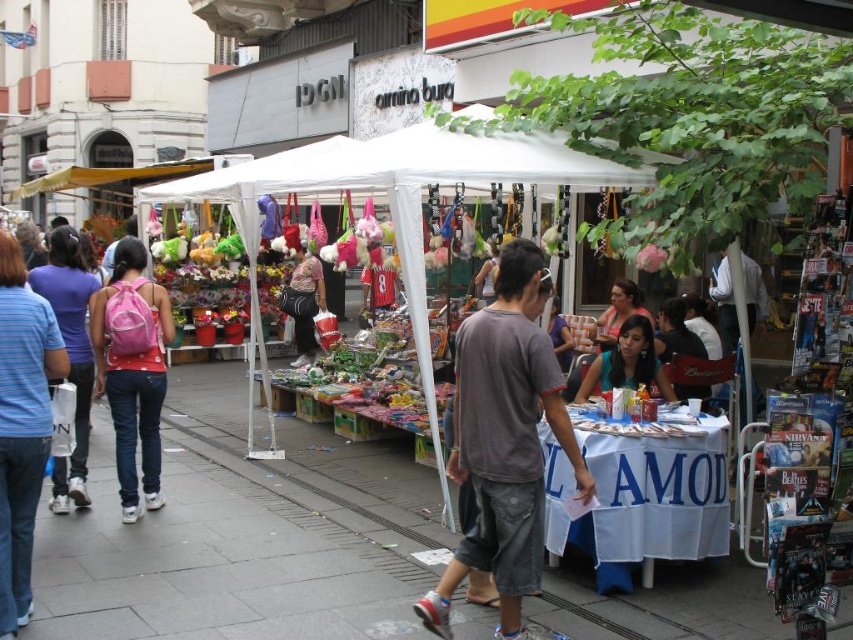
Does gray concrete sidewalk at center have a greater height compared to gray cotton t-shirt at center?

In fact, gray concrete sidewalk at center may be shorter than gray cotton t-shirt at center.

Image resolution: width=853 pixels, height=640 pixels. Identify the location of gray concrete sidewalk at center. (242, 536).

Where is `pink fabric backpack at center`? Image resolution: width=853 pixels, height=640 pixels. pink fabric backpack at center is located at coordinates (132, 369).

Who is positioned more to the left, pink fabric backpack at center or pink backpack at left?

A: Positioned to the left is pink backpack at left.

Is point (167, 307) in front of point (64, 230)?

Yes, it is in front of point (64, 230).

You are a GUI agent. You are given a task and a screenshot of the screen. Output one action in this format:
    pyautogui.click(x=<x>, y=<y>)
    Task: Click on the pink fabric backpack at center
    This screenshot has height=640, width=853.
    Given the screenshot: What is the action you would take?
    tap(132, 369)

Which is more to the right, gray concrete sidewalk at center or pink fabric backpack at center?

From the viewer's perspective, gray concrete sidewalk at center appears more on the right side.

Is gray concrete sidewalk at center taller than pink fabric backpack at center?

No, gray concrete sidewalk at center is not taller than pink fabric backpack at center.

Does point (234, 369) come in front of point (143, 424)?

No, it is behind (143, 424).

Locate an element on the screen. gray concrete sidewalk at center is located at coordinates (242, 536).